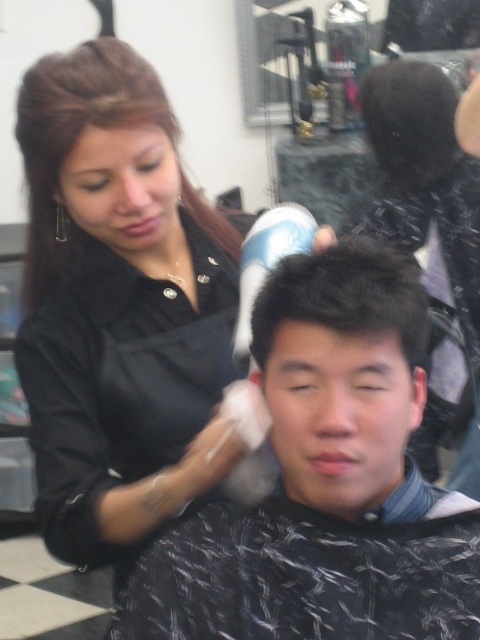
Question: Among these objects, which one is farthest from the camera?

Choices:
 (A) black matte hairdryer at upper center
 (B) smooth black hair at center
 (C) black matte hair dryer at upper center
 (D) black matte hair clip at upper left

Answer: (B)

Question: Which of the following is the closest to the observer?

Choices:
 (A) black matte hair clip at upper left
 (B) dark matte hair at center
 (C) smooth black hair at center

Answer: (B)

Question: Which of the following is the closest to the observer?

Choices:
 (A) smooth black hair at center
 (B) black matte hairdryer at upper center
 (C) dark matte hair at center

Answer: (C)

Question: Is black matte hair dryer at upper center below dark matte hair at center?

Choices:
 (A) yes
 (B) no

Answer: (A)

Question: Is the position of black matte hairdryer at upper center more distant than that of dark matte hair at center?

Choices:
 (A) yes
 (B) no

Answer: (A)

Question: Is black matte hair dryer at upper center below black matte hair at upper center?

Choices:
 (A) no
 (B) yes

Answer: (B)